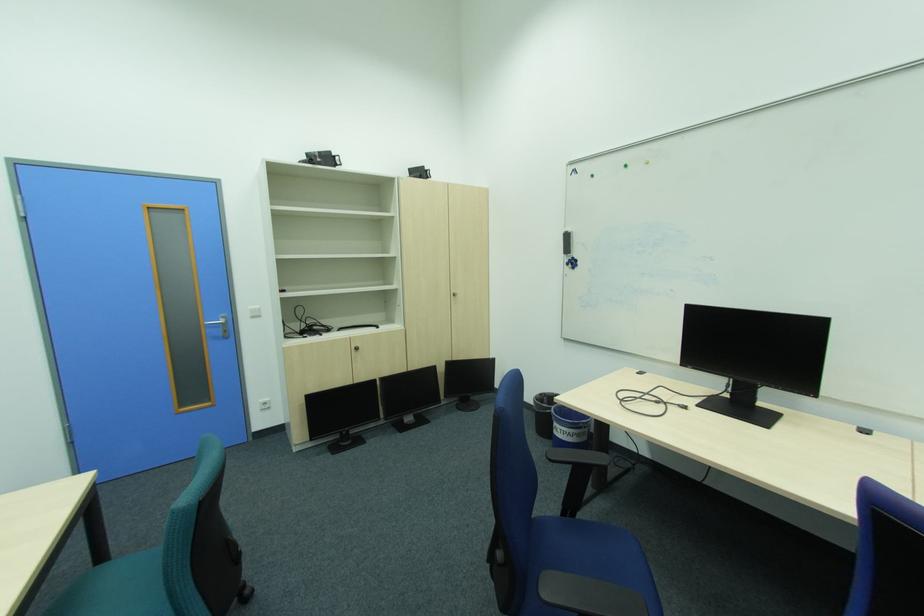
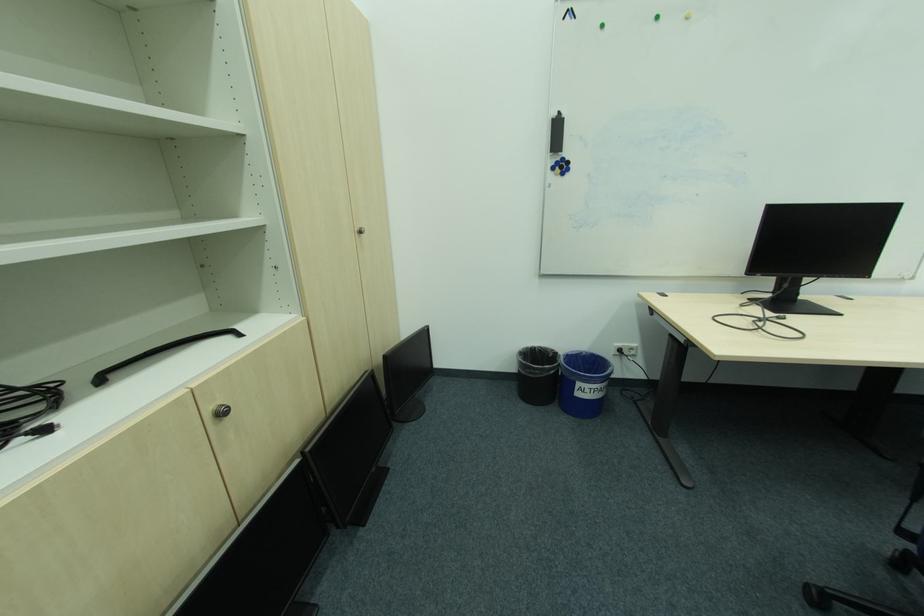
The point at (363, 349) is marked in the first image. Where is the corresponding point in the second image?

(227, 415)